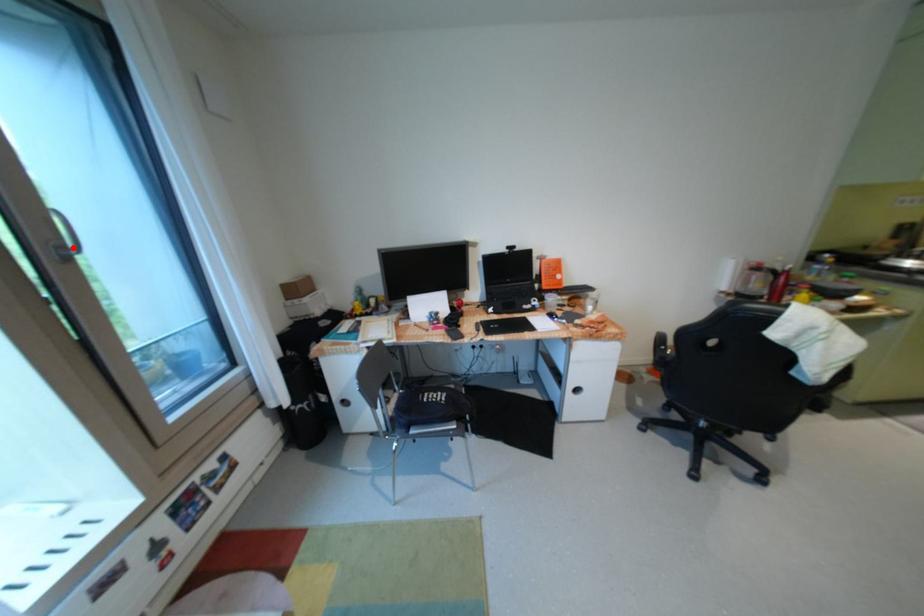
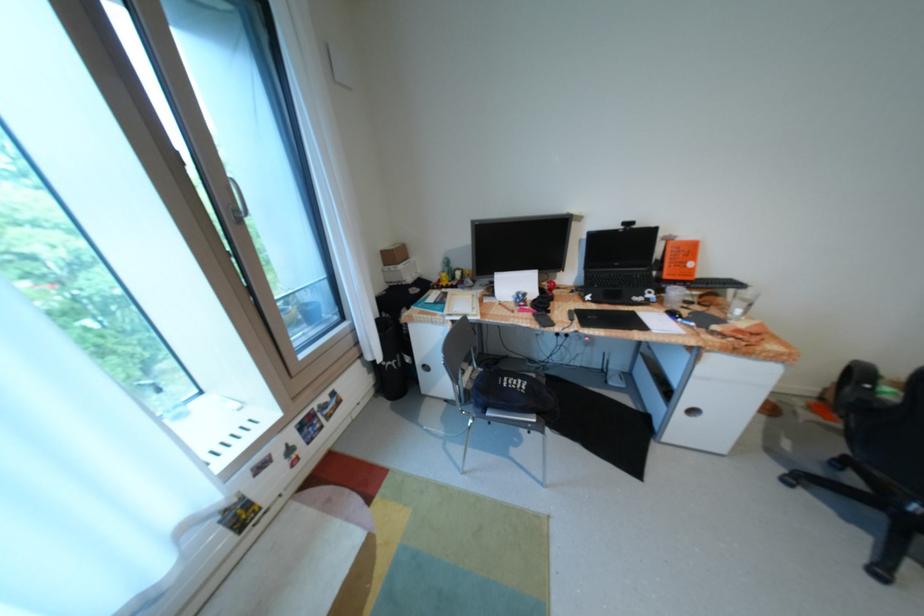
Question: I am providing you with two images of the same scene from different viewpoints. In image1, a red point is highlighted. Considering the same 3D point in image2, which of the following is correct?

Choices:
 (A) It is closer
 (B) It is farther

Answer: (A)